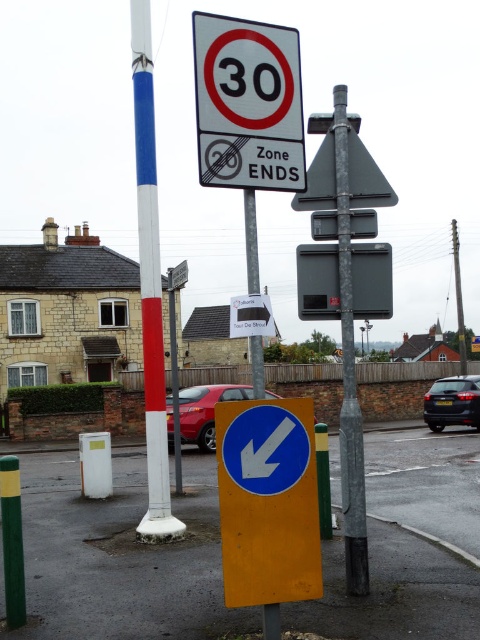
Is yellow matte arrow sign at lower center shorter than white painted pole at center?

Correct, yellow matte arrow sign at lower center is not as tall as white painted pole at center.

Is point (304, 488) farther from camera compared to point (160, 536)?

No, it is not.

Is point (228, 560) more distant than point (154, 248)?

No.

This screenshot has height=640, width=480. I want to click on yellow matte arrow sign at lower center, so click(267, 500).

Between point (239, 129) and point (350, 408), which one is positioned behind?

Positioned behind is point (350, 408).

Can you confirm if white plastic speed limit sign at upper center is positioned above galvanized steel pole at center?

Yes.

Describe the element at coordinates (248, 104) in the screenshot. I see `white plastic speed limit sign at upper center` at that location.

Locate an element on the screen. The height and width of the screenshot is (640, 480). white plastic speed limit sign at upper center is located at coordinates (248, 104).

Is point (157, 529) closer to camera compared to point (443, 381)?

Yes, it is in front of point (443, 381).

Which is behind, point (165, 435) or point (434, 388)?

The point (434, 388) is more distant.

Image resolution: width=480 pixels, height=640 pixels. Find the location of `white painted pole at center`. white painted pole at center is located at coordinates (149, 284).